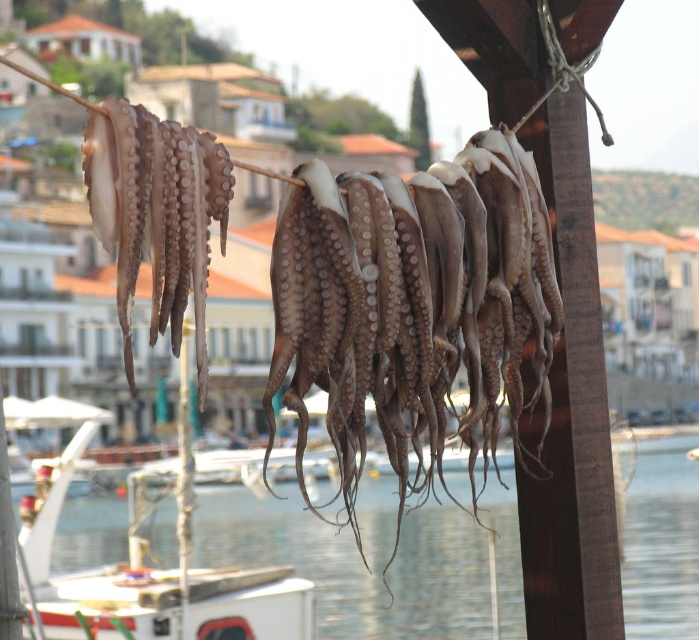
How much distance is there between brown matte squid at center and translucent water at lower center?

They are 47.00 meters apart.

Find the location of a particular element. This screenshot has height=640, width=699. brown matte squid at center is located at coordinates (415, 307).

The width and height of the screenshot is (699, 640). Find the location of `translucent water at lower center`. translucent water at lower center is located at coordinates (356, 560).

Can you confirm if translucent water at lower center is positioned to the right of brown matte squid at left?

In fact, translucent water at lower center is to the left of brown matte squid at left.

Is point (59, 516) less distant than point (108, 104)?

No, (59, 516) is further to viewer.

Identify the location of translucent water at lower center. (356, 560).

Does brown matte squid at center appear on the right side of brown matte squid at left?

Yes, brown matte squid at center is to the right of brown matte squid at left.

Is brown matte squid at center shorter than brown matte squid at left?

Incorrect, brown matte squid at center's height does not fall short of brown matte squid at left's.

This screenshot has height=640, width=699. What do you see at coordinates (415, 307) in the screenshot?
I see `brown matte squid at center` at bounding box center [415, 307].

You are a GUI agent. You are given a task and a screenshot of the screen. Output one action in this format:
    pyautogui.click(x=<x>, y=<y>)
    Task: Click on the brown matte squid at center
    
    Given the screenshot: What is the action you would take?
    pyautogui.click(x=415, y=307)